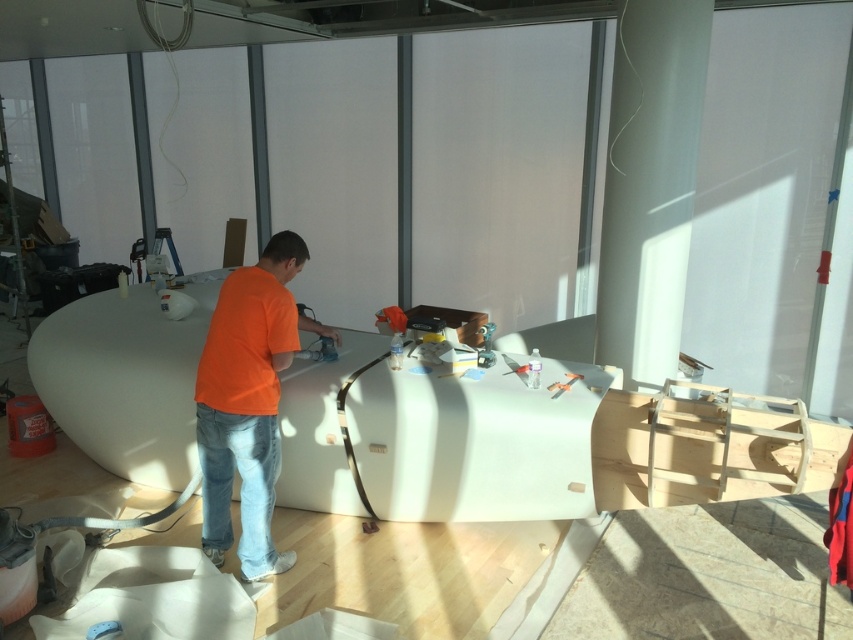
At what (x,y) coordinates should I click in order to perform the action: click on orange cotton shirt at center. Please return your answer as a coordinate pair (x, y). The width and height of the screenshot is (853, 640). Looking at the image, I should click on (248, 403).

Can you confirm if orange cotton shirt at center is taller than denim at center?

Yes, orange cotton shirt at center is taller than denim at center.

Describe the element at coordinates (248, 403) in the screenshot. I see `orange cotton shirt at center` at that location.

Locate an element on the screen. The image size is (853, 640). orange cotton shirt at center is located at coordinates (248, 403).